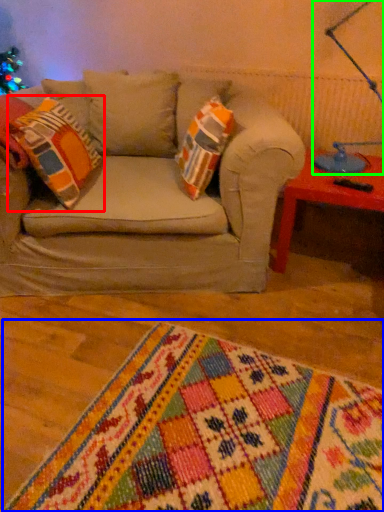
Question: Considering the real-world distances, which object is farthest from throw pillow (highlighted by a red box)? blanket (highlighted by a blue box) or table lamp (highlighted by a green box)?

Choices:
 (A) blanket
 (B) table lamp

Answer: (B)